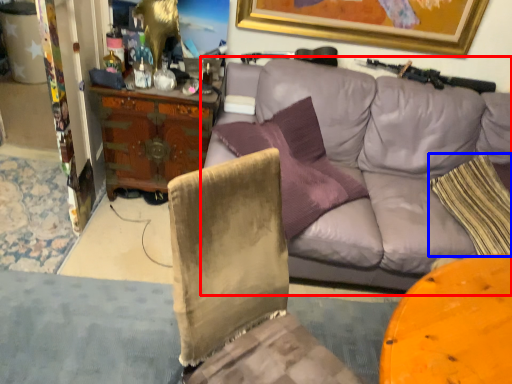
Question: Which of the following is the farthest to the observer, studio couch (highlighted by a red box) or pillow (highlighted by a blue box)?

Choices:
 (A) studio couch
 (B) pillow

Answer: (B)